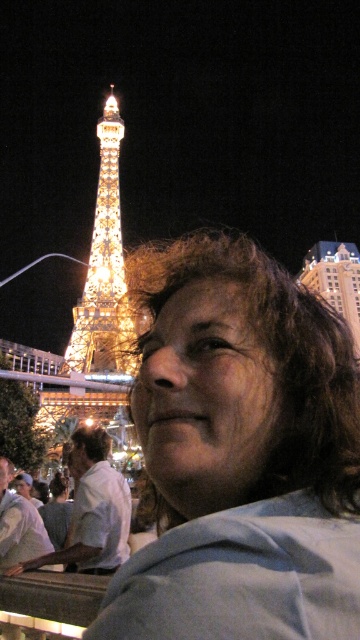
Which is more to the right, illuminated glass eiffel tower at upper left or white cotton shirt at center?

white cotton shirt at center is more to the right.

Does point (110, 132) lie in front of point (91, 545)?

No.

At what (x,y) coordinates should I click in order to perform the action: click on illuminated glass eiffel tower at upper left. Please return your answer as a coordinate pair (x, y). This screenshot has width=360, height=640. Looking at the image, I should click on (104, 273).

Does point (92, 336) come behind point (321, 269)?

No, it is not.

Is illuminated glass eiffel tower at upper left further to camera compared to golden glass tower at upper center?

That is True.

Which is behind, point (73, 392) or point (309, 266)?

Positioned behind is point (309, 266).

Locate an element on the screen. This screenshot has height=640, width=360. illuminated glass eiffel tower at upper left is located at coordinates (104, 273).

Who is more forward, (119,518) or (336,289)?

Point (119,518) is more forward.

Is point (129, 520) in front of point (318, 268)?

Yes, point (129, 520) is in front of point (318, 268).

This screenshot has height=640, width=360. Identify the location of white cotton shirt at center. (92, 509).